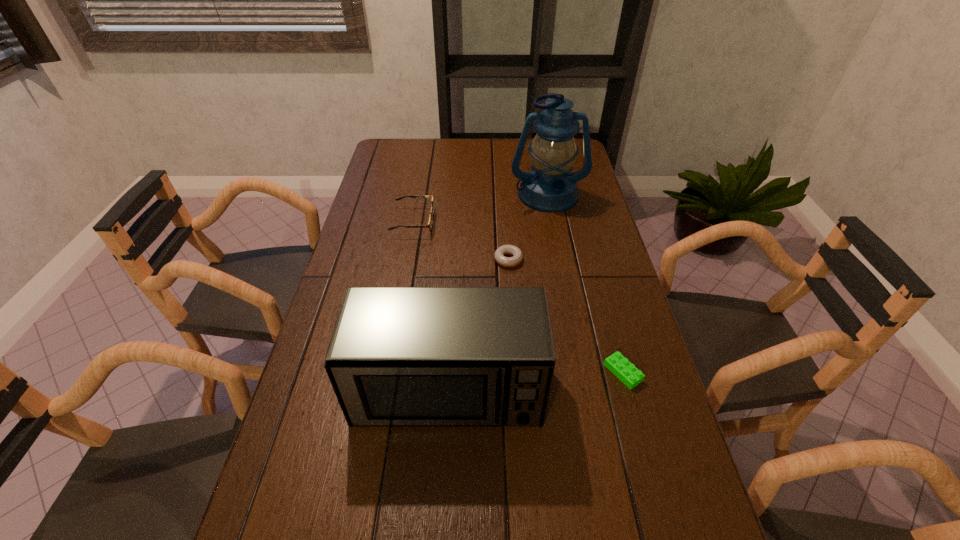
At what (x,y) coordinates should I click in order to perform the action: click on microwave_oven that is at the left edge. Please return your answer as a coordinate pair (x, y). The height and width of the screenshot is (540, 960). Looking at the image, I should click on (399, 356).

Where is `spectacles that is at the left edge`? The image size is (960, 540). spectacles that is at the left edge is located at coordinates (430, 224).

The image size is (960, 540). In order to click on lantern that is at the right edge in this screenshot , I will do `click(550, 187)`.

You are a GUI agent. You are given a task and a screenshot of the screen. Output one action in this format:
    pyautogui.click(x=<x>, y=<y>)
    Task: Click on the Lego positioned at the right edge
    Image resolution: width=960 pixels, height=540 pixels.
    Given the screenshot: What is the action you would take?
    pyautogui.click(x=624, y=370)

Where is `vacant region at the far edge`? The height and width of the screenshot is (540, 960). vacant region at the far edge is located at coordinates (453, 155).

This screenshot has width=960, height=540. In order to click on free spot at the left edge of the desktop in this screenshot , I will do (x=327, y=305).

Identify the location of blank space at the right edge of the desktop. (584, 221).

At what (x,y) coordinates should I click in order to perform the action: click on vacant space at the far left corner. Please return your answer as a coordinate pair (x, y). This screenshot has height=540, width=960. Looking at the image, I should click on (407, 161).

Locate an element on the screen. Image resolution: width=960 pixels, height=540 pixels. blank space at the far right corner is located at coordinates (577, 163).

Locate an element on the screen. Image resolution: width=960 pixels, height=540 pixels. empty location between the doughnut and the Lego is located at coordinates (565, 316).